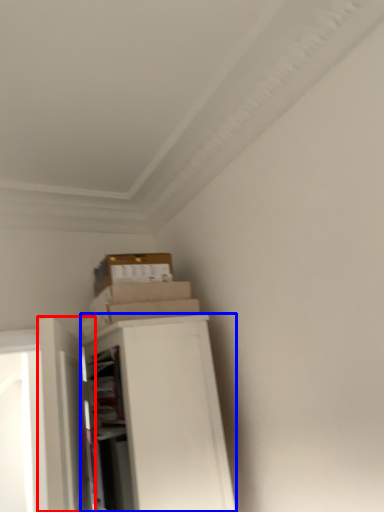
Question: Among these objects, which one is farthest to the camera, door (highlighted by a red box) or file cabinet (highlighted by a blue box)?

Choices:
 (A) door
 (B) file cabinet

Answer: (B)